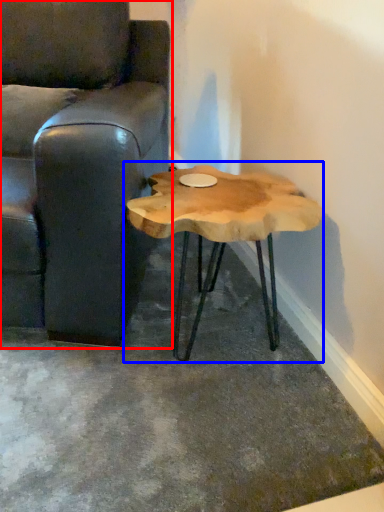
Question: Which of the following is the closest to the observer, chair (highlighted by a red box) or coffee table (highlighted by a blue box)?

Choices:
 (A) chair
 (B) coffee table

Answer: (A)